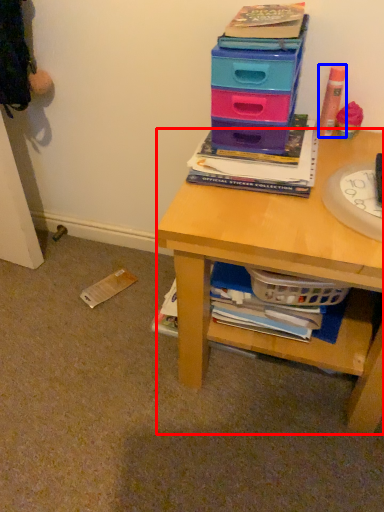
Question: Among these objects, which one is nearest to the camera, desk (highlighted by a red box) or stationery (highlighted by a blue box)?

Choices:
 (A) desk
 (B) stationery

Answer: (A)